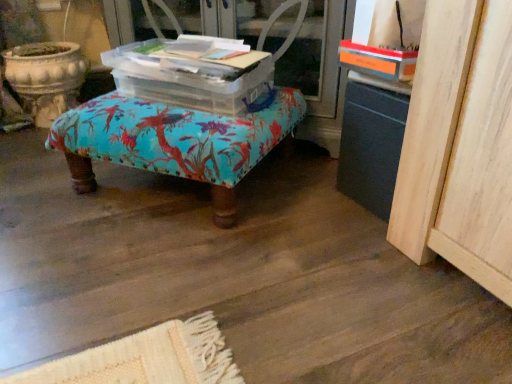
Question: From a real-world perspective, is turquoise fabric ottoman at center positioned under transparent plastic screen door at center based on gravity?

Choices:
 (A) yes
 (B) no

Answer: (A)

Question: Is transparent plastic screen door at center located within turquoise fabric ottoman at center?

Choices:
 (A) yes
 (B) no

Answer: (B)

Question: From a real-world perspective, is turquoise fabric ottoman at center over transparent plastic screen door at center?

Choices:
 (A) yes
 (B) no

Answer: (B)

Question: Considering the relative sizes of turquoise fabric ottoman at center and transparent plastic screen door at center in the image provided, is turquoise fabric ottoman at center shorter than transparent plastic screen door at center?

Choices:
 (A) no
 (B) yes

Answer: (B)

Question: From the image's perspective, does turquoise fabric ottoman at center appear lower than transparent plastic screen door at center?

Choices:
 (A) no
 (B) yes

Answer: (B)

Question: From the image's perspective, would you say turquoise fabric ottoman at center is positioned over transparent plastic screen door at center?

Choices:
 (A) yes
 (B) no

Answer: (B)

Question: Is transparent plastic screen door at center to the left of transparent plastic storage box at center from the viewer's perspective?

Choices:
 (A) no
 (B) yes

Answer: (A)

Question: Is transparent plastic screen door at center not within transparent plastic storage box at center?

Choices:
 (A) yes
 (B) no

Answer: (A)

Question: Is the position of transparent plastic screen door at center more distant than that of transparent plastic storage box at center?

Choices:
 (A) no
 (B) yes

Answer: (B)

Question: Considering the relative sizes of transparent plastic screen door at center and transparent plastic storage box at center in the image provided, is transparent plastic screen door at center wider than transparent plastic storage box at center?

Choices:
 (A) no
 (B) yes

Answer: (B)

Question: Can transparent plastic storage box at center be found inside transparent plastic screen door at center?

Choices:
 (A) yes
 (B) no

Answer: (B)

Question: Are transparent plastic screen door at center and transparent plastic storage box at center located far from each other?

Choices:
 (A) yes
 (B) no

Answer: (B)

Question: Is transparent plastic screen door at center at the right side of turquoise fabric ottoman at center?

Choices:
 (A) yes
 (B) no

Answer: (A)